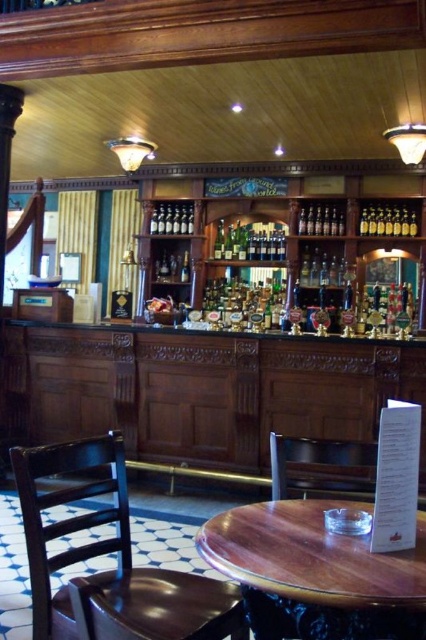
Question: Among these points, which one is nearest to the camera?

Choices:
 (A) (152, 227)
 (B) (267, 500)
 (C) (229, 588)
 (D) (238, 241)

Answer: (C)

Question: Does shiny gold bottles at upper right appear on the right side of shiny silver bottles at center?

Choices:
 (A) no
 (B) yes

Answer: (B)

Question: Which object appears farthest from the camera in this image?

Choices:
 (A) dark brown wooden chair at lower left
 (B) shiny gold bottles at upper right
 (C) green glass bottles at center

Answer: (C)

Question: Is wooden round table at center bigger than shiny silver bottles at center?

Choices:
 (A) no
 (B) yes

Answer: (B)

Question: Which point is farther from the camera taking this photo?

Choices:
 (A) (408, 209)
 (B) (279, 516)
 (C) (244, 248)
 (D) (183, 204)

Answer: (D)

Question: Is dark brown wooden chair at lower left thinner than shiny gold bottles at upper right?

Choices:
 (A) no
 (B) yes

Answer: (A)